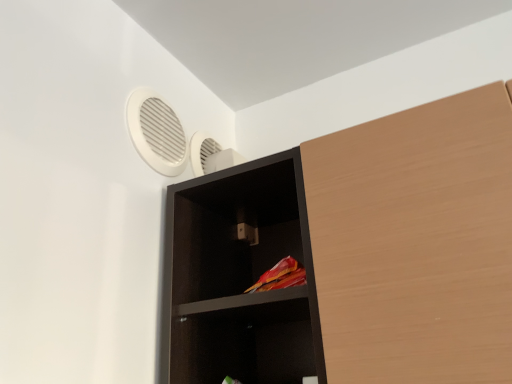
Question: From the image's perspective, would you say black matte shelf at center is positioned over white plastic fan at upper left?

Choices:
 (A) yes
 (B) no

Answer: (B)

Question: Can you confirm if black matte shelf at center is wider than white plastic fan at upper left?

Choices:
 (A) no
 (B) yes

Answer: (B)

Question: Considering the relative sizes of black matte shelf at center and white plastic fan at upper left in the image provided, is black matte shelf at center taller than white plastic fan at upper left?

Choices:
 (A) yes
 (B) no

Answer: (A)

Question: Is black matte shelf at center to the left of white plastic fan at upper left from the viewer's perspective?

Choices:
 (A) yes
 (B) no

Answer: (B)

Question: Are black matte shelf at center and white plastic fan at upper left located far from each other?

Choices:
 (A) no
 (B) yes

Answer: (A)

Question: From a real-world perspective, is black matte shelf at center located higher than white plastic fan at upper left?

Choices:
 (A) no
 (B) yes

Answer: (A)

Question: Is white plastic fan at upper left at the right side of black matte shelf at center?

Choices:
 (A) yes
 (B) no

Answer: (B)

Question: From a real-world perspective, is white plastic fan at upper left beneath black matte shelf at center?

Choices:
 (A) yes
 (B) no

Answer: (B)

Question: From the image's perspective, is white plastic fan at upper left over black matte shelf at center?

Choices:
 (A) no
 (B) yes

Answer: (B)

Question: Considering the relative sizes of white plastic fan at upper left and black matte shelf at center in the image provided, is white plastic fan at upper left thinner than black matte shelf at center?

Choices:
 (A) no
 (B) yes

Answer: (B)

Question: Can you confirm if white plastic fan at upper left is taller than black matte shelf at center?

Choices:
 (A) no
 (B) yes

Answer: (A)

Question: Is white plastic fan at upper left smaller than black matte shelf at center?

Choices:
 (A) yes
 (B) no

Answer: (A)

Question: From a real-world perspective, relative to black matte shelf at center, is white plastic fan at upper left vertically above or below?

Choices:
 (A) above
 (B) below

Answer: (A)